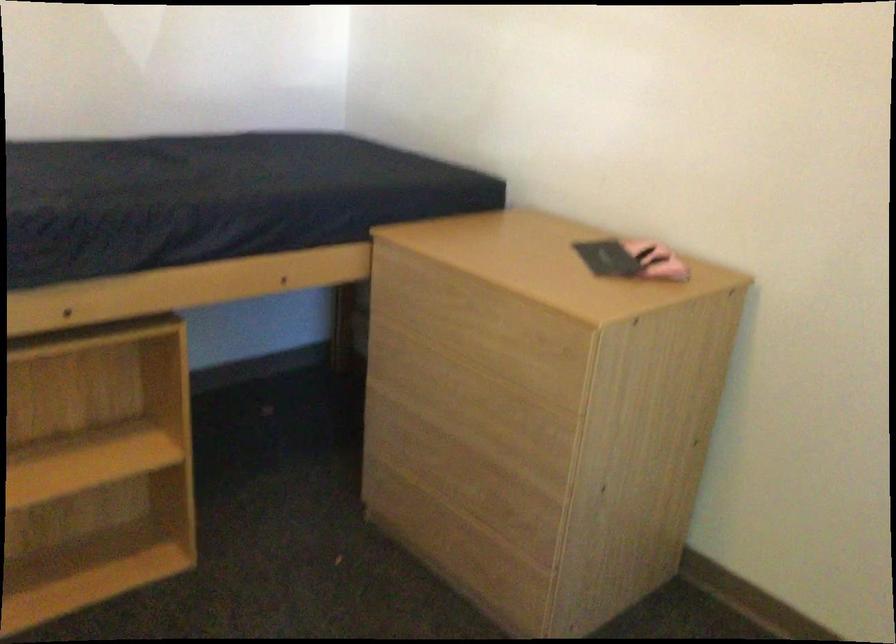
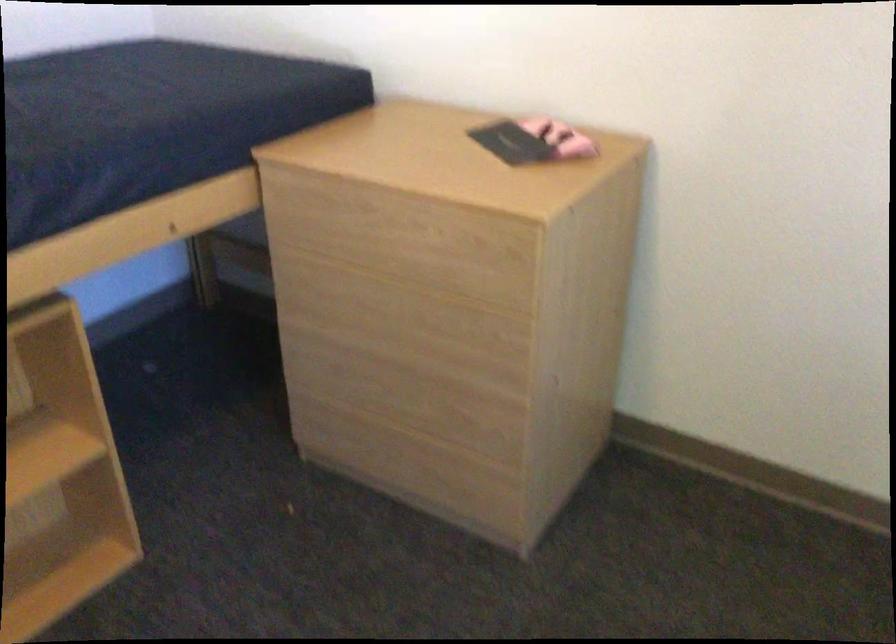
The point at (417, 287) is marked in the first image. Where is the corresponding point in the second image?

(324, 209)